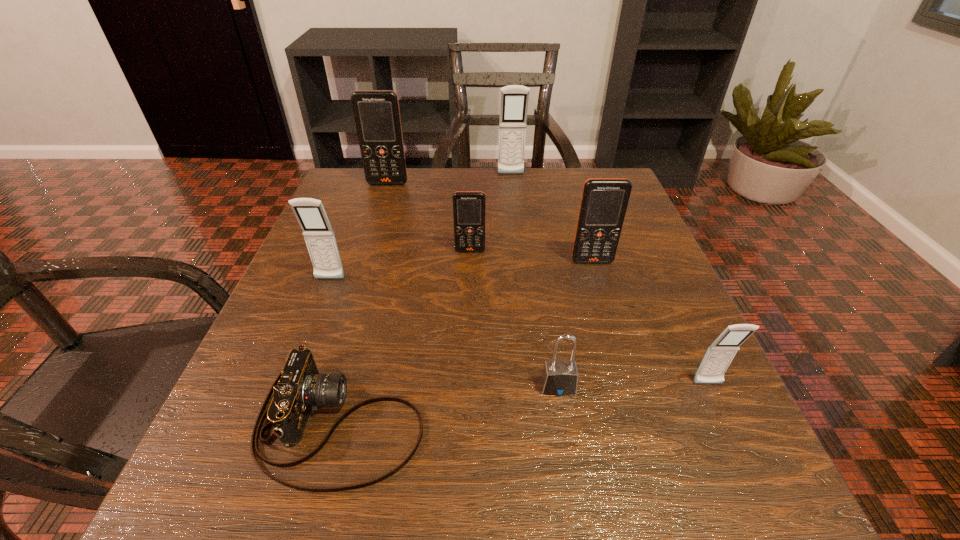
Image resolution: width=960 pixels, height=540 pixels. In order to click on the second gray cellular telephone from right to left in this screenshot , I will do `click(514, 99)`.

The height and width of the screenshot is (540, 960). What are the coordinates of `the biggest gray cellular telephone` in the screenshot? It's located at (514, 99).

You are a GUI agent. You are given a task and a screenshot of the screen. Output one action in this format:
    pyautogui.click(x=<x>, y=<y>)
    Task: Click on the second farthest cellular telephone
    The width and height of the screenshot is (960, 540).
    Given the screenshot: What is the action you would take?
    pyautogui.click(x=377, y=115)

Identify the location of the biggest orange cellular telephone. The height and width of the screenshot is (540, 960). (377, 115).

Find the location of `the fourth nearest object`. the fourth nearest object is located at coordinates (317, 231).

Image resolution: width=960 pixels, height=540 pixels. What are the coordinates of `the leftmost gray cellular telephone` in the screenshot? It's located at (317, 231).

Locate an element on the screen. the third nearest cellular telephone is located at coordinates (604, 201).

The image size is (960, 540). What are the coordinates of `the second object from right to left` in the screenshot? It's located at (604, 201).

Locate an element on the screen. This screenshot has height=540, width=960. the fifth object from right to left is located at coordinates (468, 206).

Locate an element on the screen. This screenshot has height=540, width=960. the second nearest orange cellular telephone is located at coordinates (468, 206).